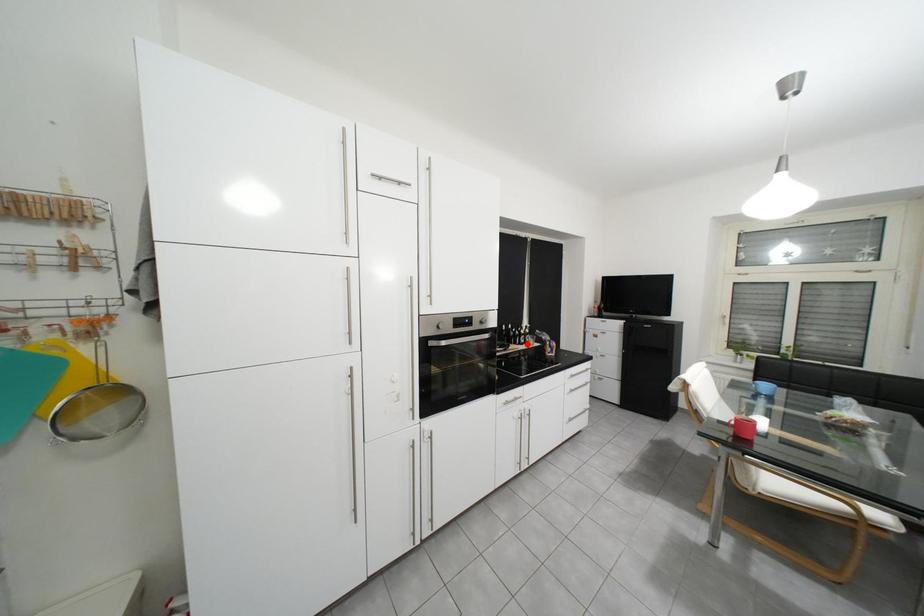
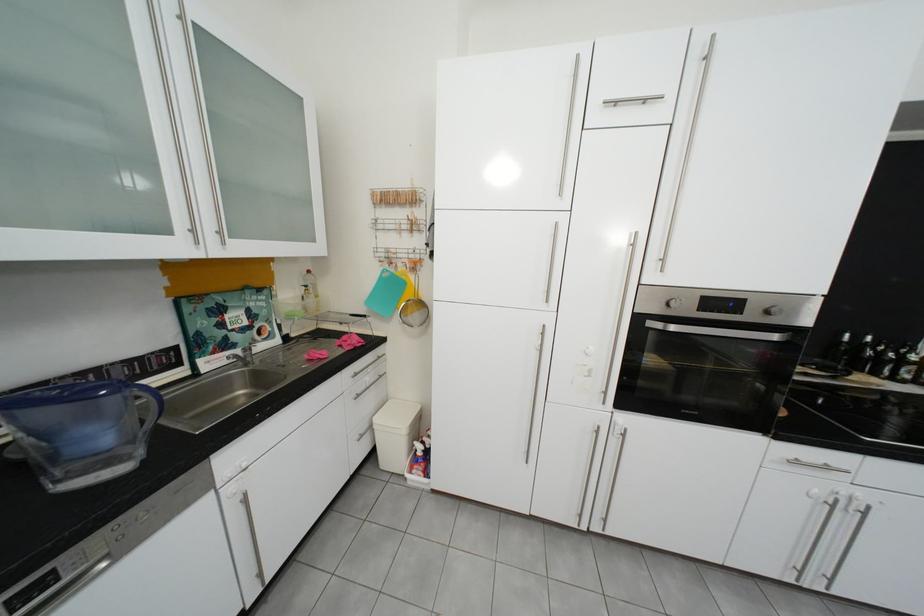
The point at the highlighted location is marked in the first image. Where is the corresponding point in the second image?

(886, 375)